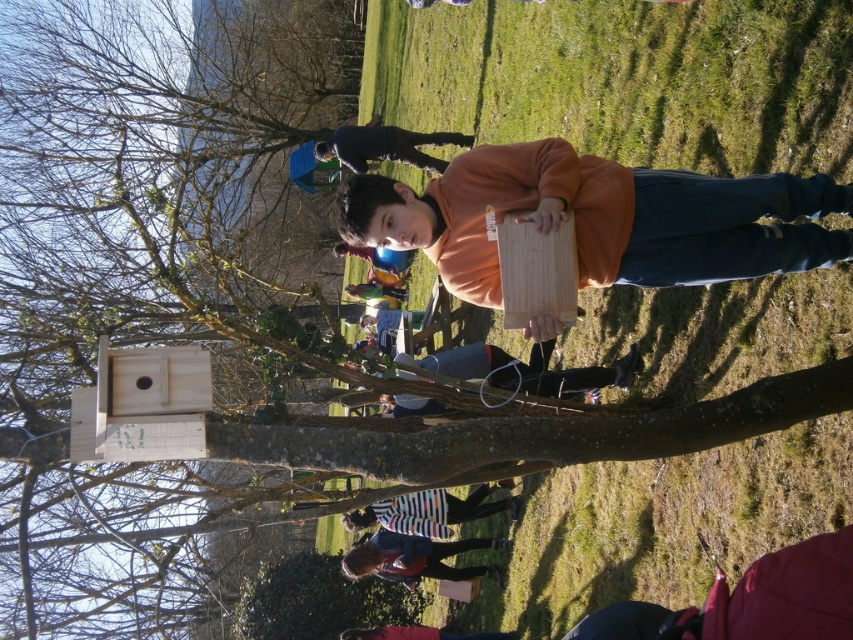
Question: Which of the following is the closest to the observer?

Choices:
 (A) (515, 147)
 (B) (466, 499)

Answer: (A)

Question: Can you confirm if striped fabric shirt at center is positioned below striped fabric shirt at lower center?

Choices:
 (A) no
 (B) yes

Answer: (A)

Question: Which of the following is the farthest from the observer?

Choices:
 (A) orange cotton hoodie at center
 (B) matte wood board at center
 (C) striped fabric shirt at lower center

Answer: (A)

Question: Which point is farther to the camera?

Choices:
 (A) (421, 512)
 (B) (426, 134)
 (C) (440, 545)

Answer: (B)

Question: Is striped fabric at center to the left of orange cotton hoodie at center from the viewer's perspective?

Choices:
 (A) yes
 (B) no

Answer: (B)

Question: Can you confirm if striped fabric shirt at center is thinner than striped fabric shirt at lower center?

Choices:
 (A) yes
 (B) no

Answer: (B)